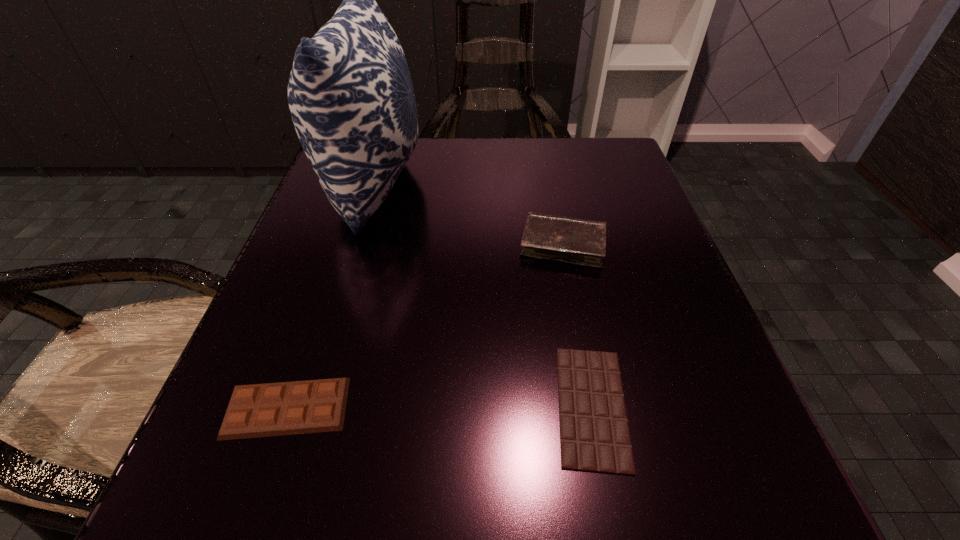
The width and height of the screenshot is (960, 540). Find the location of `cushion`. cushion is located at coordinates (351, 98).

Image resolution: width=960 pixels, height=540 pixels. I want to click on the second tallest object, so tap(582, 242).

Where is `the third tallest object`? Image resolution: width=960 pixels, height=540 pixels. the third tallest object is located at coordinates (286, 408).

Identify the location of the left chocolate bar. This screenshot has width=960, height=540. (286, 408).

You are a GUI agent. You are given a task and a screenshot of the screen. Output one action in this format:
    pyautogui.click(x=<x>, y=<y>)
    Task: Click on the shorter chocolate bar
    This screenshot has height=540, width=960.
    Given the screenshot: What is the action you would take?
    pyautogui.click(x=594, y=433)

Image resolution: width=960 pixels, height=540 pixels. Identify the location of the right chocolate bar. (594, 433).

You are a GUI agent. You are given a task and a screenshot of the screen. Output one action in this format:
    pyautogui.click(x=<x>, y=<y>)
    Task: Click on the vacant point located 0.270m on the front surface of the cushion
    The image size is (960, 540).
    Given the screenshot: What is the action you would take?
    pyautogui.click(x=554, y=183)

I want to click on free spot located 0.220m on the left of the third shortest object, so click(x=393, y=244).

At what (x,y) coordinates should I click in order to perform the action: click on blank space located 0.280m on the right of the third tallest object. Please return your answer as a coordinate pair (x, y). Image resolution: width=960 pixels, height=540 pixels. Looking at the image, I should click on (573, 408).

The image size is (960, 540). What are the coordinates of `vacant region located 0.060m on the right of the shortest object` in the screenshot? It's located at (679, 406).